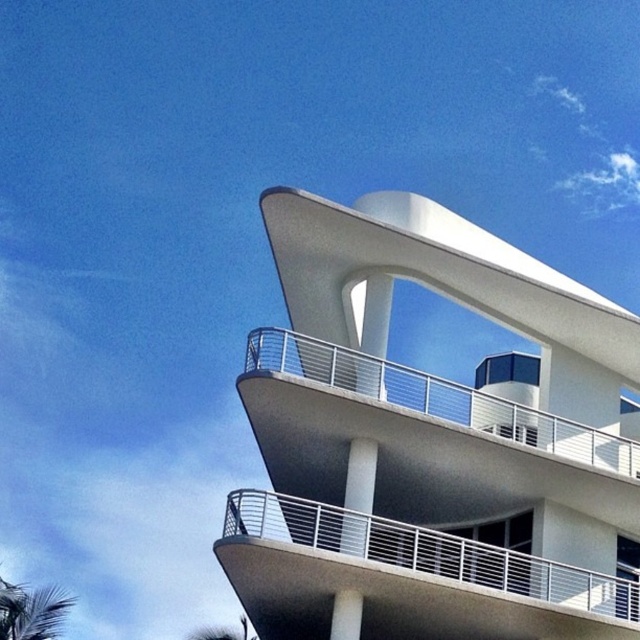
You are standing at the base of the modern architectural structure and want to estimate how far the white smooth balcony at upper right is from you. Based on the scene, can you provide an approximate distance?

The white smooth balcony at upper right is approximately 35.07 meters away from the viewer.

You are an architect examining the building. You notice the white smooth balcony at upper right and the white metal railing at center. Which one is positioned to the right side of the other?

The white smooth balcony at upper right is positioned to the right of the white metal railing at center.